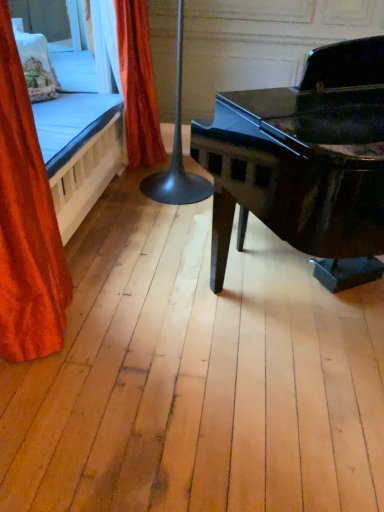
Question: From the image's perspective, is embroidered fabric pillow at upper left above orange velvet curtain at left, marked as the 1th curtain in a front-to-back arrangement?

Choices:
 (A) yes
 (B) no

Answer: (A)

Question: Are embroidered fabric pillow at upper left and orange velvet curtain at left, the second curtain positioned from the back, located far from each other?

Choices:
 (A) yes
 (B) no

Answer: (A)

Question: From a real-world perspective, is embroidered fabric pillow at upper left on top of orange velvet curtain at left, marked as the 1th curtain in a front-to-back arrangement?

Choices:
 (A) yes
 (B) no

Answer: (A)

Question: Could you tell me if embroidered fabric pillow at upper left is facing orange velvet curtain at left, the second curtain positioned from the back?

Choices:
 (A) yes
 (B) no

Answer: (B)

Question: Is orange velvet curtain at left, marked as the 1th curtain in a front-to-back arrangement, at the back of embroidered fabric pillow at upper left?

Choices:
 (A) yes
 (B) no

Answer: (B)

Question: In terms of height, does black glossy table lamp at center look taller or shorter compared to embroidered fabric pillow at upper left?

Choices:
 (A) short
 (B) tall

Answer: (B)

Question: From the image's perspective, is black glossy table lamp at center above or below embroidered fabric pillow at upper left?

Choices:
 (A) above
 (B) below

Answer: (B)

Question: Do you think black glossy table lamp at center is within embroidered fabric pillow at upper left, or outside of it?

Choices:
 (A) outside
 (B) inside

Answer: (A)

Question: Considering the positions of point (178, 99) and point (23, 75), is point (178, 99) closer or farther from the camera than point (23, 75)?

Choices:
 (A) closer
 (B) farther

Answer: (B)

Question: Considering the positions of orange velvet curtain at upper left, which ranks as the 2th curtain in front-to-back order, and black glossy table lamp at center in the image, is orange velvet curtain at upper left, which ranks as the 2th curtain in front-to-back order, wider or thinner than black glossy table lamp at center?

Choices:
 (A) thin
 (B) wide

Answer: (A)

Question: Based on their sizes in the image, would you say orange velvet curtain at upper left, which ranks as the 2th curtain in front-to-back order, is bigger or smaller than black glossy table lamp at center?

Choices:
 (A) small
 (B) big

Answer: (A)

Question: From a real-world perspective, relative to black glossy table lamp at center, is orange velvet curtain at upper left, the first curtain in the back-to-front sequence, vertically above or below?

Choices:
 (A) above
 (B) below

Answer: (B)

Question: In the image, is orange velvet curtain at upper left, which ranks as the 2th curtain in front-to-back order, on the left side or the right side of black glossy table lamp at center?

Choices:
 (A) left
 (B) right

Answer: (A)

Question: Is embroidered fabric pillow at upper left bigger or smaller than orange velvet curtain at upper left, which ranks as the 2th curtain in front-to-back order?

Choices:
 (A) small
 (B) big

Answer: (A)

Question: Based on their positions, is embroidered fabric pillow at upper left located to the left or right of orange velvet curtain at upper left, which ranks as the 2th curtain in front-to-back order?

Choices:
 (A) right
 (B) left

Answer: (B)